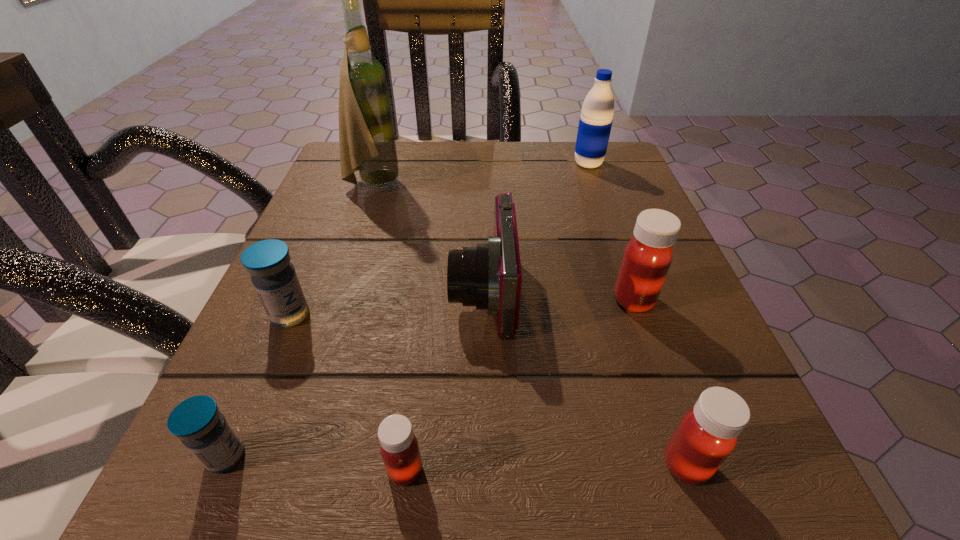
In the image, there is a desktop. Find the location of `vacant area at the near edge`. vacant area at the near edge is located at coordinates (321, 531).

Identify the location of vacant area at the left edge. The width and height of the screenshot is (960, 540). (323, 200).

In the image, there is a desktop. Where is `free space at the right edge`? free space at the right edge is located at coordinates (640, 199).

I want to click on free space at the far left corner, so click(358, 171).

Identify the location of blank space at the near left corner of the desktop. This screenshot has height=540, width=960. (205, 524).

At what (x,y) coordinates should I click in order to perform the action: click on vacant area at the far right corner of the desktop. Please return your answer as a coordinate pair (x, y). Looking at the image, I should click on (618, 176).

Find the location of a particular element. Image resolution: width=960 pixels, height=540 pixels. free point between the fourth object from left to right and the smaller blue medicine is located at coordinates (316, 463).

Find the location of a particular element. This screenshot has height=540, width=960. free spot between the second smallest red medicine and the tallest object is located at coordinates (530, 325).

This screenshot has width=960, height=540. What are the coordinates of `empty location between the camera and the second biggest red medicine` in the screenshot? It's located at (585, 378).

Where is `vacant space that's between the third medicine from left to right and the biggest red medicine`? Image resolution: width=960 pixels, height=540 pixels. vacant space that's between the third medicine from left to right and the biggest red medicine is located at coordinates (519, 385).